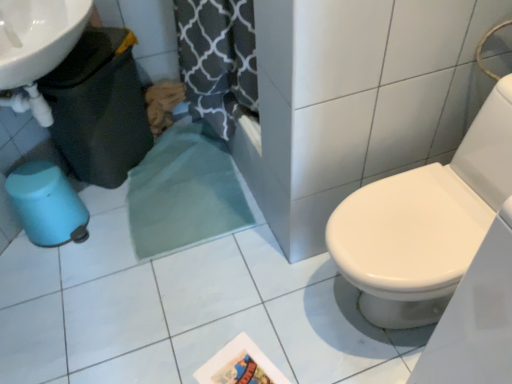
What do you see at coordinates (47, 204) in the screenshot? Image resolution: width=512 pixels, height=384 pixels. I see `matte plastic potty at lower left, placed as the 2th potty when sorted from top to bottom` at bounding box center [47, 204].

Measure the distance between point (26, 178) and camera.

Point (26, 178) is 5.29 feet away from camera.

Identify the location of matte plastic potty at lower left, which is the 1th potty from bottom to top. This screenshot has height=384, width=512. (47, 204).

Image resolution: width=512 pixels, height=384 pixels. Describe the element at coordinates (99, 108) in the screenshot. I see `matte black trash can at left, arranged as the 2th potty when ordered from the bottom` at that location.

Identify the location of matte black trash can at left, marked as the 1th potty in a top-to-bottom arrangement. The image size is (512, 384). (99, 108).

Identify the location of matte plastic potty at lower left, placed as the 2th potty when sorted from top to bottom. The height and width of the screenshot is (384, 512). click(x=47, y=204).

Is matte plastic potty at lower left, placed as the 2th potty when sorted from top to bottom, to the left of matte black trash can at left, arranged as the 2th potty when ordered from the bottom, from the viewer's perspective?

Yes.

Considering the relative positions of matte plastic potty at lower left, placed as the 2th potty when sorted from top to bottom, and matte black trash can at left, arranged as the 2th potty when ordered from the bottom, in the image provided, is matte plastic potty at lower left, placed as the 2th potty when sorted from top to bottom, in front of matte black trash can at left, arranged as the 2th potty when ordered from the bottom,?

No, matte plastic potty at lower left, placed as the 2th potty when sorted from top to bottom, is further to the viewer.

Is point (42, 220) positioned after point (51, 73)?

Yes, it is.

From the image's perspective, is matte plastic potty at lower left, placed as the 2th potty when sorted from top to bottom, on matte black trash can at left, marked as the 1th potty in a top-to-bottom arrangement?

Incorrect, from the image's perspective, matte plastic potty at lower left, placed as the 2th potty when sorted from top to bottom, is lower than matte black trash can at left, marked as the 1th potty in a top-to-bottom arrangement.

Consider the image. From a real-world perspective, is matte plastic potty at lower left, which is the 1th potty from bottom to top, physically below matte black trash can at left, arranged as the 2th potty when ordered from the bottom?

Yes.

Considering the sizes of matte plastic potty at lower left, which is the 1th potty from bottom to top, and matte black trash can at left, marked as the 1th potty in a top-to-bottom arrangement, in the image, is matte plastic potty at lower left, which is the 1th potty from bottom to top, wider or thinner than matte black trash can at left, marked as the 1th potty in a top-to-bottom arrangement,?

matte plastic potty at lower left, which is the 1th potty from bottom to top, is wider than matte black trash can at left, marked as the 1th potty in a top-to-bottom arrangement.

Consider the image. Considering the relative sizes of matte plastic potty at lower left, placed as the 2th potty when sorted from top to bottom, and matte black trash can at left, marked as the 1th potty in a top-to-bottom arrangement, in the image provided, is matte plastic potty at lower left, placed as the 2th potty when sorted from top to bottom, shorter than matte black trash can at left, marked as the 1th potty in a top-to-bottom arrangement,?

Yes, matte plastic potty at lower left, placed as the 2th potty when sorted from top to bottom, is shorter than matte black trash can at left, marked as the 1th potty in a top-to-bottom arrangement.

Can you confirm if matte plastic potty at lower left, placed as the 2th potty when sorted from top to bottom, is smaller than matte black trash can at left, arranged as the 2th potty when ordered from the bottom?

Yes, matte plastic potty at lower left, placed as the 2th potty when sorted from top to bottom, is smaller than matte black trash can at left, arranged as the 2th potty when ordered from the bottom.

Can matte black trash can at left, marked as the 1th potty in a top-to-bottom arrangement, be found inside matte plastic potty at lower left, which is the 1th potty from bottom to top?

That's incorrect, matte black trash can at left, marked as the 1th potty in a top-to-bottom arrangement, is not inside matte plastic potty at lower left, which is the 1th potty from bottom to top.

Is matte plastic potty at lower left, placed as the 2th potty when sorted from top to bottom, beside matte black trash can at left, arranged as the 2th potty when ordered from the bottom?

No, matte plastic potty at lower left, placed as the 2th potty when sorted from top to bottom, is not beside matte black trash can at left, arranged as the 2th potty when ordered from the bottom.

Is matte plastic potty at lower left, placed as the 2th potty when sorted from top to bottom, facing away from matte black trash can at left, arranged as the 2th potty when ordered from the bottom?

No, matte plastic potty at lower left, placed as the 2th potty when sorted from top to bottom, is not facing the opposite direction of matte black trash can at left, arranged as the 2th potty when ordered from the bottom.

Where is `potty above the matte plastic potty at lower left, placed as the 2th potty when sorted from top to bottom (from a real-world perspective)`? This screenshot has width=512, height=384. potty above the matte plastic potty at lower left, placed as the 2th potty when sorted from top to bottom (from a real-world perspective) is located at coordinates (99, 108).

Which is more to the right, matte black trash can at left, marked as the 1th potty in a top-to-bottom arrangement, or matte plastic potty at lower left, placed as the 2th potty when sorted from top to bottom?

matte black trash can at left, marked as the 1th potty in a top-to-bottom arrangement.

Which object is further away from the camera, matte black trash can at left, arranged as the 2th potty when ordered from the bottom, or matte plastic potty at lower left, placed as the 2th potty when sorted from top to bottom?

Positioned behind is matte plastic potty at lower left, placed as the 2th potty when sorted from top to bottom.

Considering the positions of points (77, 119) and (25, 209), is point (77, 119) closer to camera compared to point (25, 209)?

That is False.

From the image's perspective, is matte black trash can at left, arranged as the 2th potty when ordered from the bottom, on matte plastic potty at lower left, placed as the 2th potty when sorted from top to bottom?

Yes, from the image's perspective, matte black trash can at left, arranged as the 2th potty when ordered from the bottom, is on top of matte plastic potty at lower left, placed as the 2th potty when sorted from top to bottom.

From the picture: From a real-world perspective, between matte black trash can at left, marked as the 1th potty in a top-to-bottom arrangement, and matte plastic potty at lower left, placed as the 2th potty when sorted from top to bottom, who is vertically higher?

In real-world perspective, matte black trash can at left, marked as the 1th potty in a top-to-bottom arrangement, is above.

Looking at this image, which of these two, matte black trash can at left, marked as the 1th potty in a top-to-bottom arrangement, or matte plastic potty at lower left, which is the 1th potty from bottom to top, is wider?

matte plastic potty at lower left, which is the 1th potty from bottom to top.

Is matte black trash can at left, arranged as the 2th potty when ordered from the bottom, shorter than matte plastic potty at lower left, placed as the 2th potty when sorted from top to bottom?

In fact, matte black trash can at left, arranged as the 2th potty when ordered from the bottom, may be taller than matte plastic potty at lower left, placed as the 2th potty when sorted from top to bottom.

Based on their sizes in the image, would you say matte black trash can at left, marked as the 1th potty in a top-to-bottom arrangement, is bigger or smaller than matte plastic potty at lower left, which is the 1th potty from bottom to top?

matte black trash can at left, marked as the 1th potty in a top-to-bottom arrangement, is bigger than matte plastic potty at lower left, which is the 1th potty from bottom to top.

In the scene shown: Is matte plastic potty at lower left, which is the 1th potty from bottom to top, a part of matte black trash can at left, marked as the 1th potty in a top-to-bottom arrangement?

No, matte plastic potty at lower left, which is the 1th potty from bottom to top, is located outside of matte black trash can at left, marked as the 1th potty in a top-to-bottom arrangement.

Is matte black trash can at left, marked as the 1th potty in a top-to-bottom arrangement, next to matte plastic potty at lower left, which is the 1th potty from bottom to top?

matte black trash can at left, marked as the 1th potty in a top-to-bottom arrangement, is not next to matte plastic potty at lower left, which is the 1th potty from bottom to top, and they're not touching.

Is matte black trash can at left, arranged as the 2th potty when ordered from the bottom, turned away from matte plastic potty at lower left, which is the 1th potty from bottom to top?

No, matte black trash can at left, arranged as the 2th potty when ordered from the bottom, is not facing away from matte plastic potty at lower left, which is the 1th potty from bottom to top.

This screenshot has height=384, width=512. Find the location of `potty in front of the matte plastic potty at lower left, which is the 1th potty from bottom to top`. potty in front of the matte plastic potty at lower left, which is the 1th potty from bottom to top is located at coordinates (99, 108).

In order to click on potty on the right of matte plastic potty at lower left, placed as the 2th potty when sorted from top to bottom in this screenshot , I will do `click(99, 108)`.

This screenshot has height=384, width=512. In order to click on potty that is in front of the matte plastic potty at lower left, which is the 1th potty from bottom to top in this screenshot , I will do `click(99, 108)`.